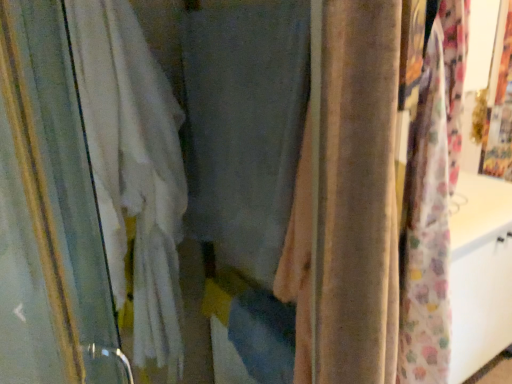
Question: In which direction should I rotate to look at velvet beige curtain at center, which is the 3th curtain from left to right?

Choices:
 (A) left
 (B) right

Answer: (B)

Question: Can you confirm if white fabric curtain at left, which is the 1th curtain from left to right, is shorter than velvet beige curtain at center, the first curtain from the right?

Choices:
 (A) yes
 (B) no

Answer: (B)

Question: Considering the relative positions of white fabric curtain at left, which is the 1th curtain from left to right, and velvet beige curtain at center, which is the 3th curtain from left to right, in the image provided, is white fabric curtain at left, which is the 1th curtain from left to right, to the right of velvet beige curtain at center, which is the 3th curtain from left to right, from the viewer's perspective?

Choices:
 (A) yes
 (B) no

Answer: (B)

Question: Is white fabric curtain at left, which is the 1th curtain from left to right, thinner than velvet beige curtain at center, the first curtain from the right?

Choices:
 (A) yes
 (B) no

Answer: (B)

Question: Does white fabric curtain at left, which is the 1th curtain from left to right, have a greater width compared to velvet beige curtain at center, which is the 3th curtain from left to right?

Choices:
 (A) no
 (B) yes

Answer: (B)

Question: Does white fabric curtain at left, which is the 1th curtain from left to right, touch velvet beige curtain at center, the first curtain from the right?

Choices:
 (A) no
 (B) yes

Answer: (A)

Question: From the image's perspective, would you say matte gray curtain at center, which is the 2th curtain in left-to-right order, is shown under white fabric curtain at left, which is the 1th curtain from left to right?

Choices:
 (A) no
 (B) yes

Answer: (A)

Question: Is matte gray curtain at center, which is the 2th curtain in left-to-right order, taller than white fabric curtain at left, which is the 1th curtain from left to right?

Choices:
 (A) yes
 (B) no

Answer: (B)

Question: Is white fabric curtain at left, which is the 1th curtain from left to right, surrounded by matte gray curtain at center, arranged as the 2th curtain when viewed from the right?

Choices:
 (A) no
 (B) yes

Answer: (A)

Question: Does matte gray curtain at center, which is the 2th curtain in left-to-right order, turn towards white fabric curtain at left, which is the 1th curtain from left to right?

Choices:
 (A) no
 (B) yes

Answer: (B)

Question: Is matte gray curtain at center, arranged as the 2th curtain when viewed from the right, bigger than white fabric curtain at left, which is the 1th curtain from left to right?

Choices:
 (A) yes
 (B) no

Answer: (B)

Question: Is matte gray curtain at center, arranged as the 2th curtain when viewed from the right, smaller than white fabric curtain at left, placed as the 3th curtain when sorted from right to left?

Choices:
 (A) no
 (B) yes

Answer: (B)

Question: Can we say velvet beige curtain at center, the first curtain from the right, lies outside white fabric curtain at left, which is the 1th curtain from left to right?

Choices:
 (A) no
 (B) yes

Answer: (B)